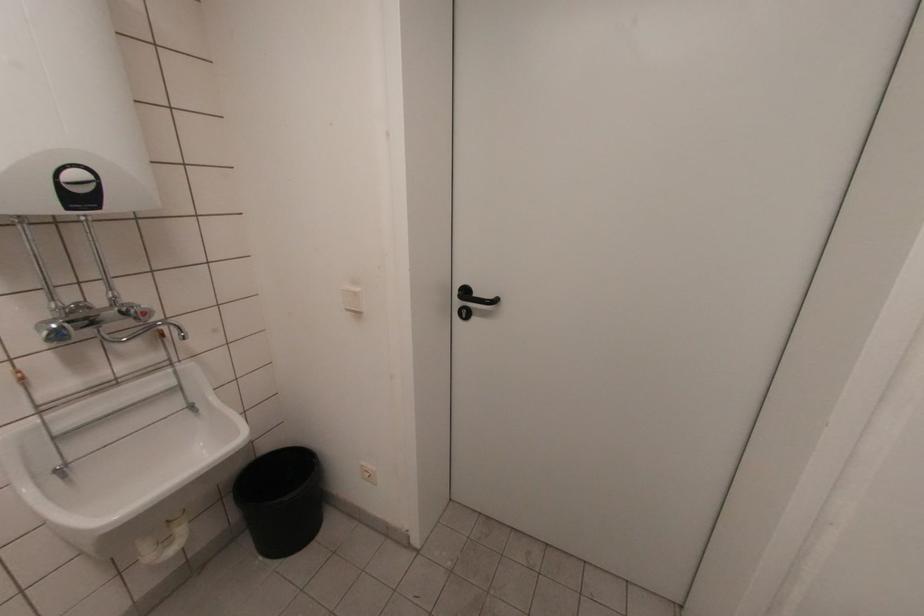
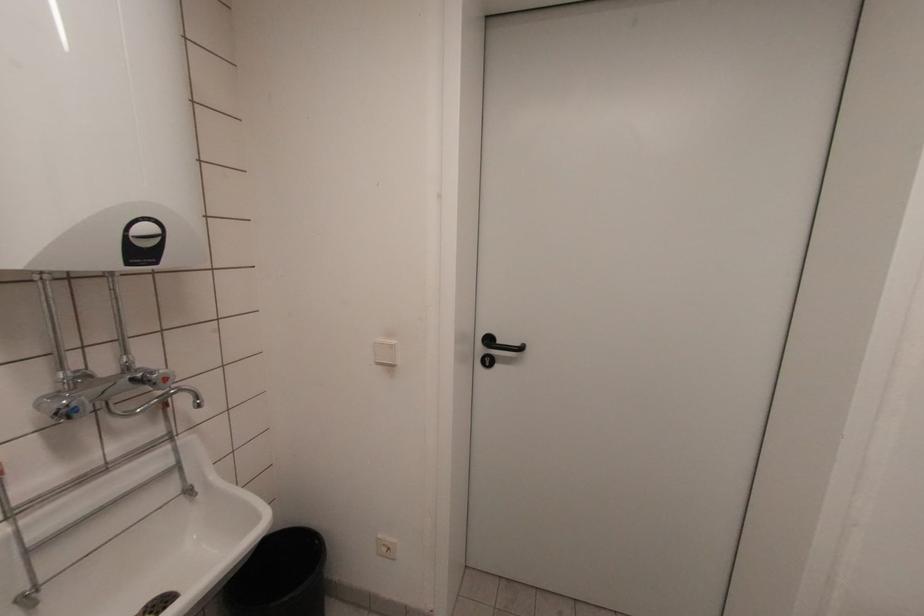
Locate, in the second image, the point that corresponds to point 345,302 in the first image.

(375, 355)